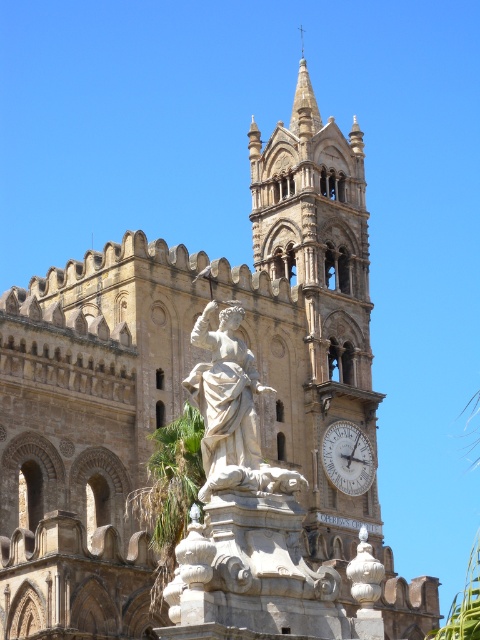
You are an art student visiting the cathedral and want to sketch the scene. You need to decide which object to draw first based on their sizes. Which one should you focus on first, the white marble statue at center or the white marble clock at upper center?

The white marble statue at center is larger in size than the white marble clock at upper center, so you should focus on drawing the white marble statue at center first as it requires more attention due to its larger size.

You are standing at the entrance of the cathedral and want to locate the white marble statue at center. According to the coordinates provided, which direction should you face to see it directly?

The white marble statue at center is located at coordinates 0.642 on the x axis and 0.483 on the y axis. Since the x coordinate is greater than 0.5, it is positioned to the right side of the central axis. Therefore, you should face towards the right side to see the white marble statue at center directly.

You are an architect visiting the cathedral and want to compare the height of the white marble statue at center and the smooth stone spire at upper center. Which one is taller?

The smooth stone spire at upper center is taller than the white marble statue at center.